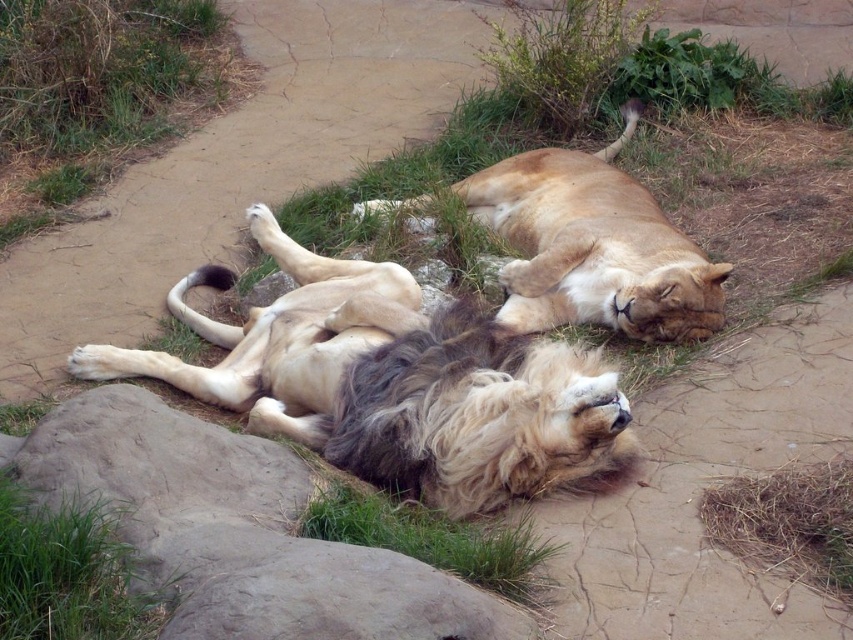
Question: Considering the real-world distances, which object is closest to the golden fur lion at upper center?

Choices:
 (A) green soft grass at lower center
 (B) golden fur lion at center

Answer: (B)

Question: Is golden fur lion at center thinner than green grass at upper left?

Choices:
 (A) yes
 (B) no

Answer: (B)

Question: From the image, what is the correct spatial relationship of gray rock at lower left in relation to golden fur lion at upper center?

Choices:
 (A) below
 (B) above

Answer: (A)

Question: Can you confirm if golden fur lion at upper center is thinner than green grass at lower left?

Choices:
 (A) no
 (B) yes

Answer: (A)

Question: Which point appears farthest from the camera in this image?

Choices:
 (A) (399, 202)
 (B) (22, 508)
 (C) (477, 561)

Answer: (A)

Question: Which object appears closest to the camera in this image?

Choices:
 (A) golden fur lion at upper center
 (B) green grass at lower left
 (C) golden fur lion at center
 (D) gray rock at lower left

Answer: (D)